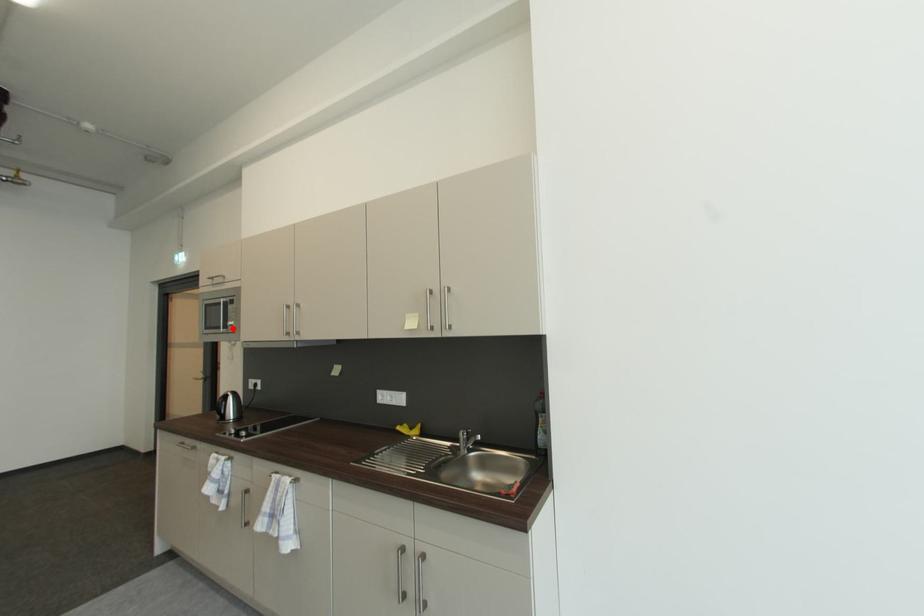
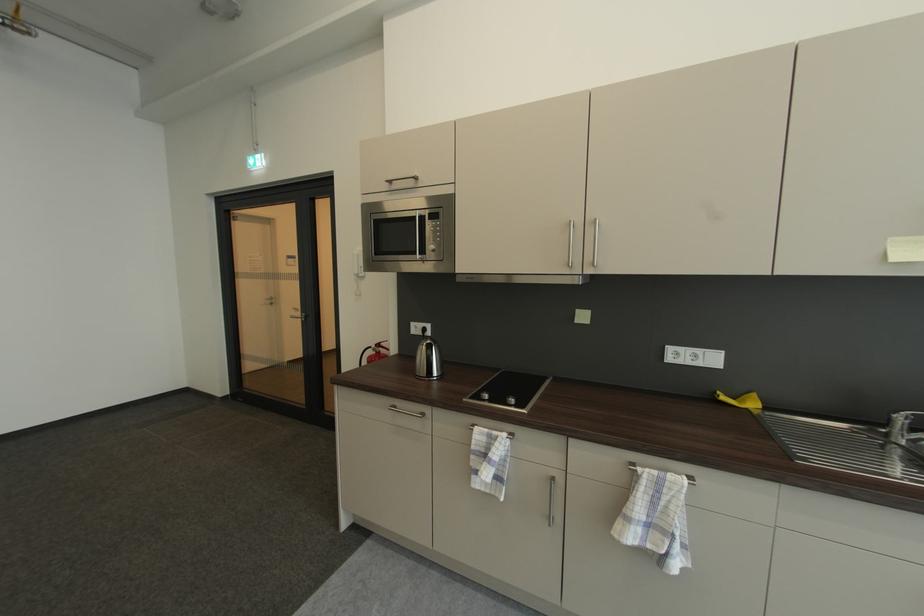
The point at the highlighted location is marked in the first image. Where is the corresponding point in the second image?

(430, 254)